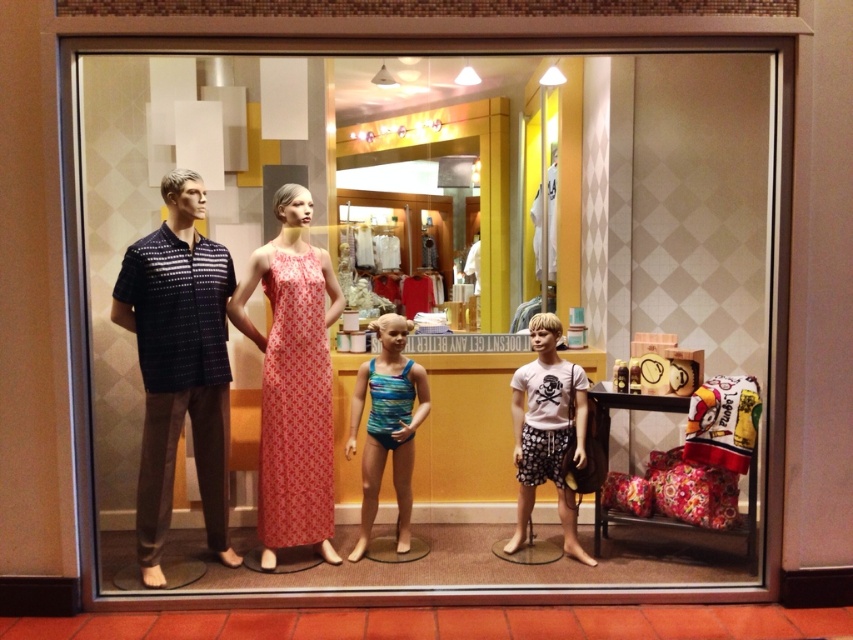
Can you confirm if matte black mannequin at left is bigger than matte pink dress at center?

Yes, matte black mannequin at left is bigger than matte pink dress at center.

Who is shorter, matte black mannequin at left or matte pink dress at center?

With less height is matte pink dress at center.

Locate an element on the screen. matte black mannequin at left is located at coordinates tap(422, 316).

Who is shorter, matte dark blue shirt at left or matte pink dress at center?

Standing shorter between the two is matte pink dress at center.

The width and height of the screenshot is (853, 640). What are the coordinates of `matte dark blue shirt at left` in the screenshot? It's located at (178, 365).

Does matte black mannequin at left come behind white matte t-shirt at center?

No, it is in front of white matte t-shirt at center.

Can you confirm if matte black mannequin at left is shorter than white matte t-shirt at center?

Incorrect, matte black mannequin at left's height does not fall short of white matte t-shirt at center's.

Which is behind, point (216, 420) or point (535, 333)?

Positioned behind is point (535, 333).

The image size is (853, 640). Find the location of `matte black mannequin at left`. matte black mannequin at left is located at coordinates (422, 316).